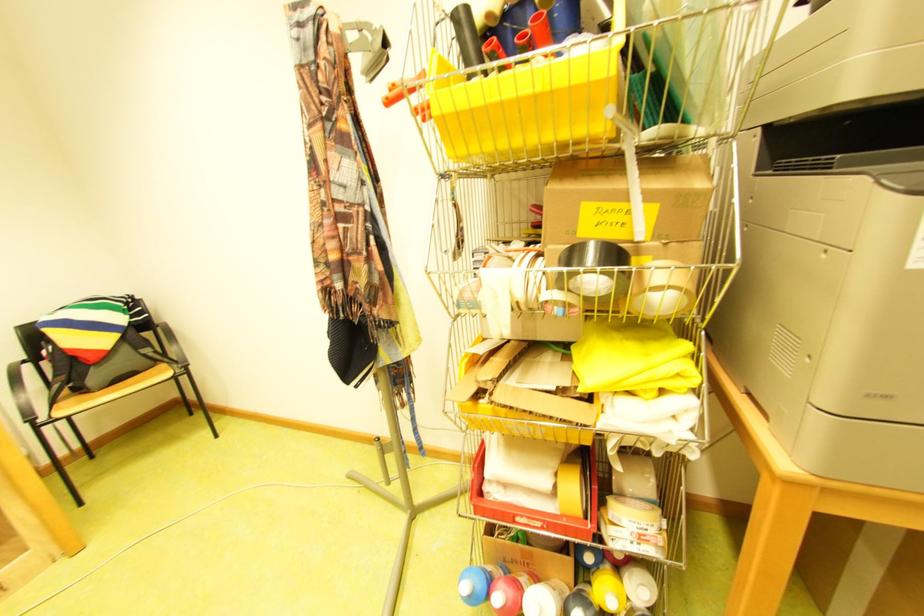
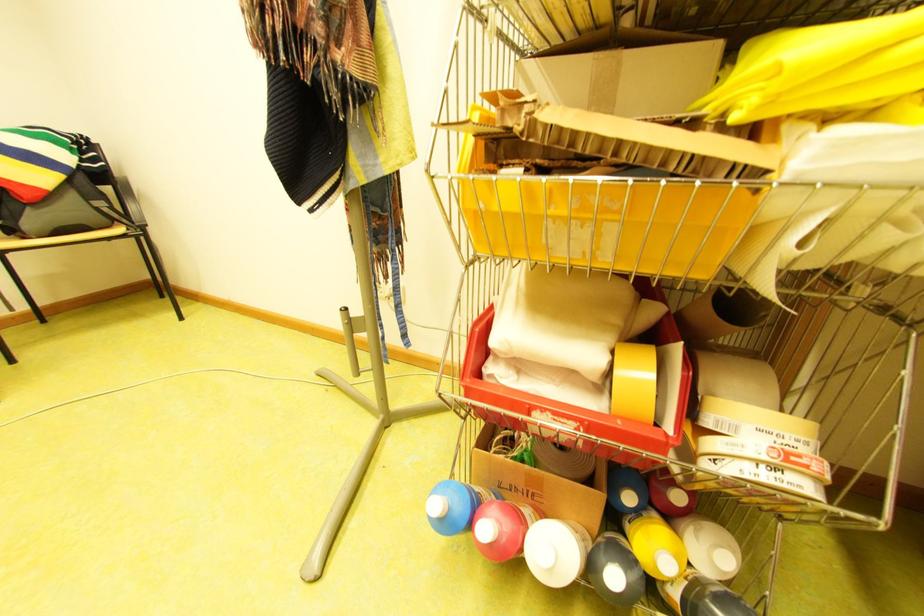
Question: What movement of the cameraman would produce the second image?

Choices:
 (A) Left
 (B) Right
 (C) Forward
 (D) Backward

Answer: (C)